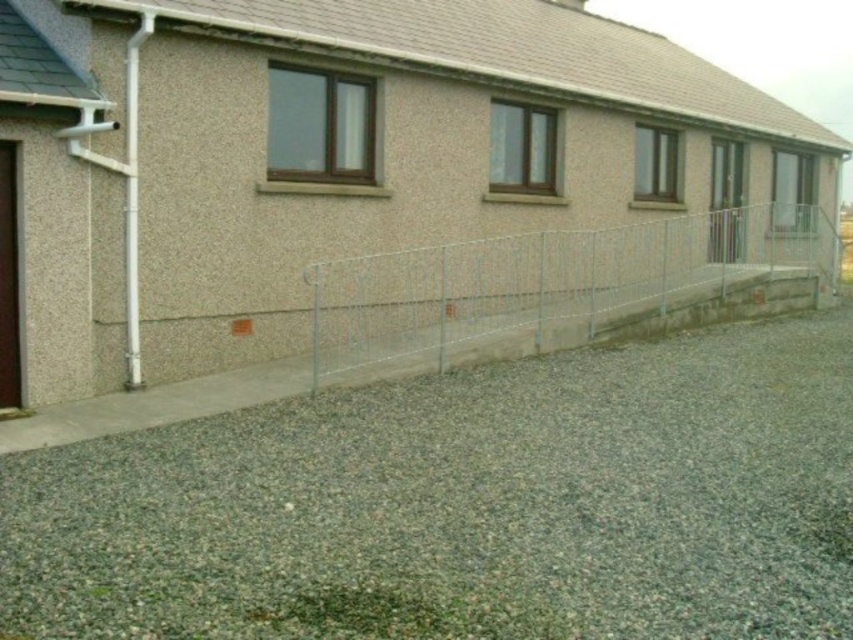
Question: Is silver metallic fence at center smaller than brown wooden door at left?

Choices:
 (A) yes
 (B) no

Answer: (B)

Question: Can you confirm if gray gravel at lower center is positioned to the right of silver metallic fence at center?

Choices:
 (A) yes
 (B) no

Answer: (B)

Question: Where is gray gravel at lower center located in relation to brown wooden door at left in the image?

Choices:
 (A) left
 (B) right

Answer: (B)

Question: Among these objects, which one is nearest to the camera?

Choices:
 (A) silver metallic fence at center
 (B) brown wooden door at left
 (C) gray gravel at lower center

Answer: (C)

Question: Based on their relative distances, which object is farther from the silver metallic fence at center?

Choices:
 (A) gray gravel at lower center
 (B) brown wooden door at left

Answer: (A)

Question: Which of these objects is positioned closest to the brown wooden door at left?

Choices:
 (A) gray gravel at lower center
 (B) silver metallic fence at center

Answer: (A)